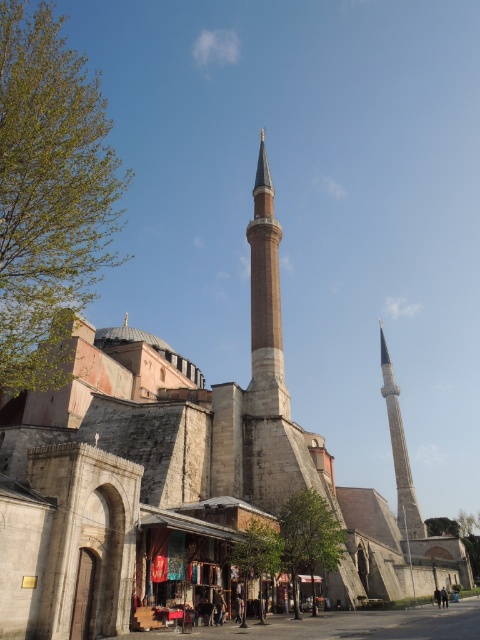
Question: Which point is closer to the camera?

Choices:
 (A) [403, 522]
 (B) [262, 282]

Answer: (B)

Question: Is smooth stone minaret at center to the left of gray stone minaret at right from the viewer's perspective?

Choices:
 (A) yes
 (B) no

Answer: (A)

Question: Which point is closer to the camera?

Choices:
 (A) smooth stone minaret at center
 (B) gray stone minaret at right

Answer: (A)

Question: Does smooth stone minaret at center have a lesser width compared to gray stone minaret at right?

Choices:
 (A) no
 (B) yes

Answer: (B)

Question: Which point is closer to the camera taking this photo?

Choices:
 (A) (279, 321)
 (B) (388, 371)

Answer: (A)

Question: Does smooth stone minaret at center appear over gray stone minaret at right?

Choices:
 (A) yes
 (B) no

Answer: (A)